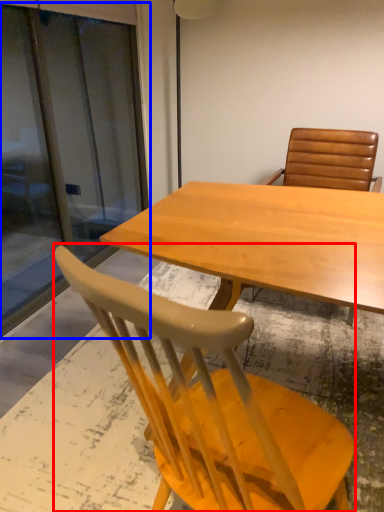
Question: Which point is further to the camera, chair (highlighted by a red box) or screen door (highlighted by a blue box)?

Choices:
 (A) chair
 (B) screen door

Answer: (B)